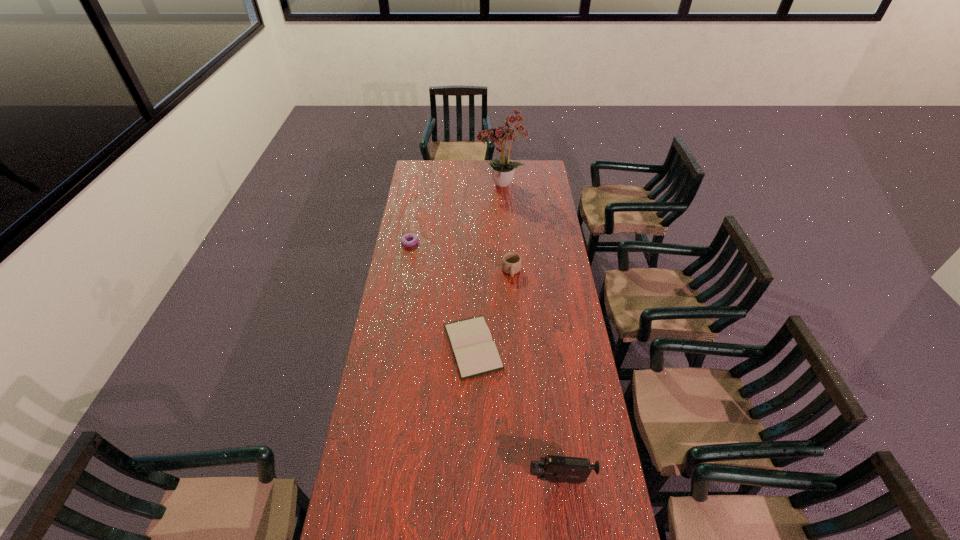
The image size is (960, 540). I want to click on the tallest object, so click(503, 170).

Where is `flower arrangement`? The image size is (960, 540). flower arrangement is located at coordinates (503, 170).

This screenshot has height=540, width=960. I want to click on the second tallest object, so click(x=554, y=469).

Where is `the nearest object`? the nearest object is located at coordinates (554, 469).

Identify the location of the third tallest object. Image resolution: width=960 pixels, height=540 pixels. (511, 263).

Image resolution: width=960 pixels, height=540 pixels. In order to click on mug in this screenshot , I will do `click(511, 263)`.

The image size is (960, 540). I want to click on the leftmost object, so click(x=405, y=237).

At what (x,y) coordinates should I click in order to perform the action: click on doughnut. Please return your answer as a coordinate pair (x, y). This screenshot has width=960, height=540. Looking at the image, I should click on (405, 237).

Where is `the shortest object`? Image resolution: width=960 pixels, height=540 pixels. the shortest object is located at coordinates (475, 353).

At what (x,y) coordinates should I click in order to perform the action: click on the second nearest object. Please return your answer as a coordinate pair (x, y). Looking at the image, I should click on [475, 353].